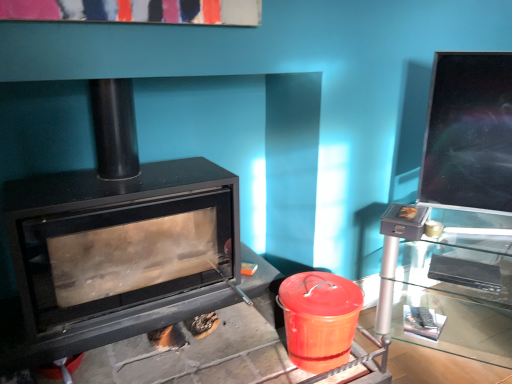
Question: From a real-world perspective, is black matte wood burning stove at left positioned above or below glossy ceramic crock pot at lower right?

Choices:
 (A) above
 (B) below

Answer: (A)

Question: Is black matte wood burning stove at left bigger or smaller than glossy ceramic crock pot at lower right?

Choices:
 (A) small
 (B) big

Answer: (B)

Question: Which object is positioned closest to the transparent glass table at right?

Choices:
 (A) glossy ceramic crock pot at lower right
 (B) black matte wood burning stove at left

Answer: (A)

Question: Which of these objects is positioned farthest from the transparent glass table at right?

Choices:
 (A) glossy ceramic crock pot at lower right
 (B) black matte wood burning stove at left

Answer: (B)